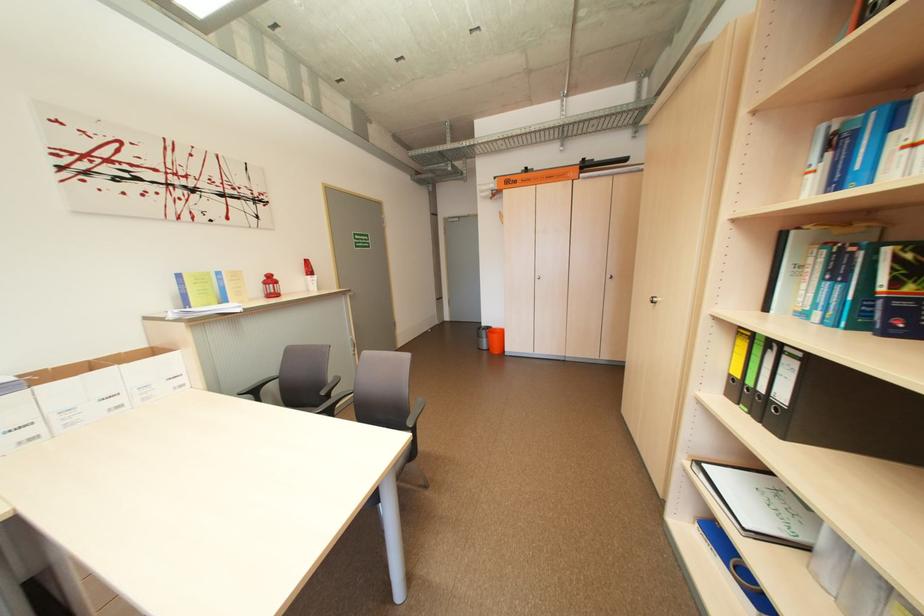
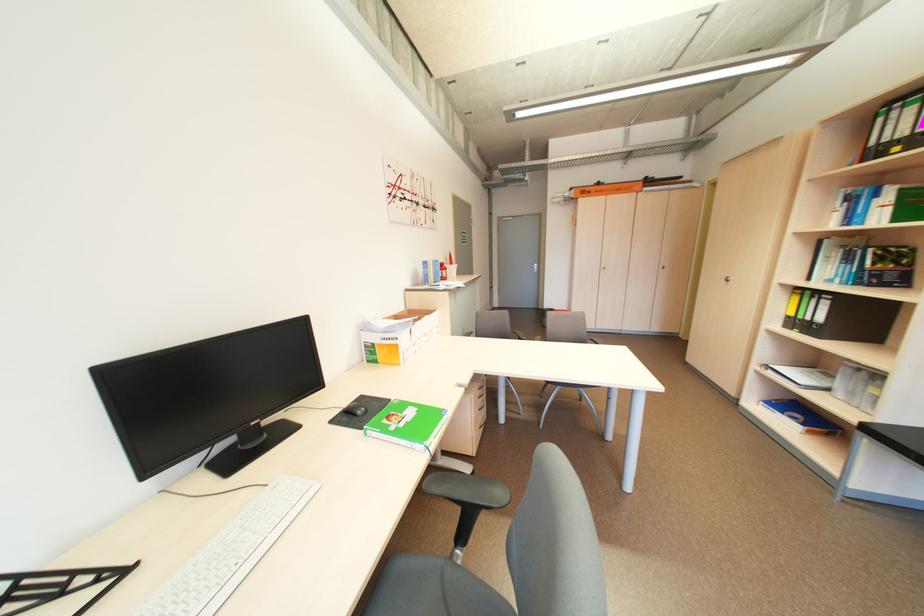
Question: I am providing you with two images of the same scene from different viewpoints. Which of the following objects are not visible in image2?

Choices:
 (A) black chair armrest
 (B) grey chair sitting surface
 (C) red-capped soda bottle
 (D) yellow binder

Answer: (A)